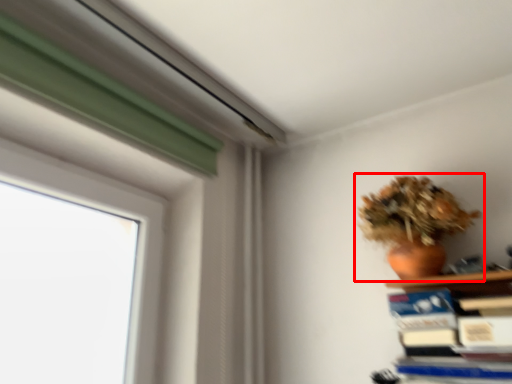
Question: Where is houseplant (annotated by the red box) located in relation to paperback book in the image?

Choices:
 (A) left
 (B) right

Answer: (A)